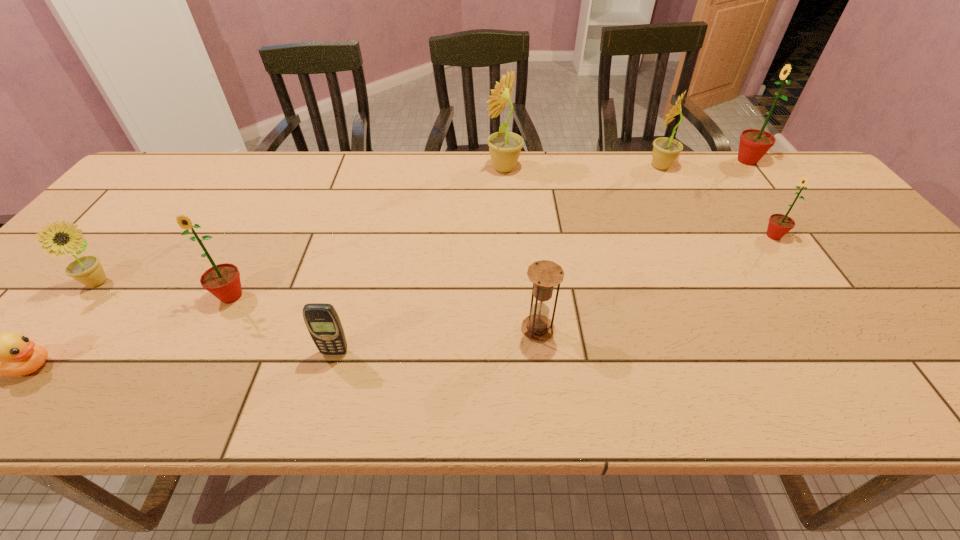
Find the location of a particular element. The image size is (960, 540). vacant space that satisfies the following two spatial constraints: 1. on the face of the second smallest yellow sunflower; 2. on the screen of the gray cellular telephone is located at coordinates (757, 352).